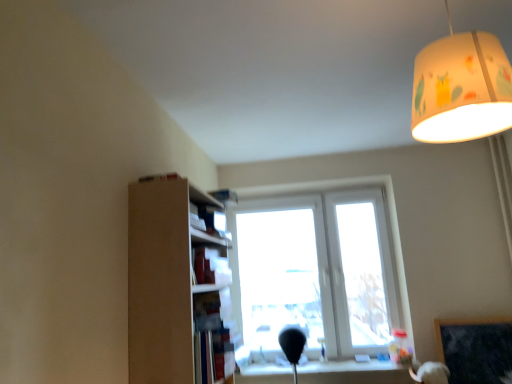
What do you see at coordinates (176, 287) in the screenshot?
I see `brown cardboard shelf at left` at bounding box center [176, 287].

Describe the element at coordinates (461, 88) in the screenshot. I see `white fabric lampshade at upper right` at that location.

In order to face hardcover book at upper center, should I rotate leftwards or rightwards?

To align with it, rotate left about 6.131°.

The height and width of the screenshot is (384, 512). What do you see at coordinates (209, 220) in the screenshot? I see `hardcover book at upper center` at bounding box center [209, 220].

At what (x,y) coordinates should I click in order to perform the action: click on brown cardboard shelf at left. Please return your answer as a coordinate pair (x, y). The height and width of the screenshot is (384, 512). Looking at the image, I should click on (176, 287).

Between dark gray matte bulletin board at lower right and hardcover book at upper center, which one appears on the left side from the viewer's perspective?

hardcover book at upper center is more to the left.

From the image's perspective, does dark gray matte bulletin board at lower right appear lower than hardcover book at upper center?

Correct, dark gray matte bulletin board at lower right appears lower than hardcover book at upper center in the image.

Is dark gray matte bulletin board at lower right touching hardcover book at upper center?

dark gray matte bulletin board at lower right and hardcover book at upper center are not in contact.

Considering the positions of objects dark gray matte bulletin board at lower right and hardcover book at upper center in the image provided, who is in front, dark gray matte bulletin board at lower right or hardcover book at upper center?

hardcover book at upper center is in front.

From a real-world perspective, which is physically above, transparent glass window at center or dark gray matte bulletin board at lower right?

From a 3D spatial view, transparent glass window at center is above.

Is transparent glass window at center next to dark gray matte bulletin board at lower right and touching it?

No, transparent glass window at center is not with dark gray matte bulletin board at lower right.

Is point (268, 235) positioned behind point (459, 320)?

Yes, it is behind point (459, 320).

Is transparent glass window at center further to the viewer compared to dark gray matte bulletin board at lower right?

That is True.

Is dark gray matte bulletin board at lower right facing away from transparent glass window at center?

No.

From a real-world perspective, is dark gray matte bulletin board at lower right on top of transparent glass window at center?

No, from a real-world perspective, dark gray matte bulletin board at lower right is not above transparent glass window at center.

From the image's perspective, is dark gray matte bulletin board at lower right positioned above or below transparent glass window at center?

dark gray matte bulletin board at lower right is below transparent glass window at center.

Is dark gray matte bulletin board at lower right bigger than transparent glass window at center?

Incorrect, dark gray matte bulletin board at lower right is not larger than transparent glass window at center.

Is point (509, 102) positioned in front of point (192, 221)?

Yes.

Is white fabric lampshade at upper right positioned far away from hardcover book at upper center?

Yes, white fabric lampshade at upper right and hardcover book at upper center are quite far apart.

Is white fabric lampshade at upper right taller than hardcover book at upper center?

Indeed, white fabric lampshade at upper right has a greater height compared to hardcover book at upper center.

Which object is further away from the camera, white fabric lampshade at upper right or hardcover book at upper center?

hardcover book at upper center.

Is dark gray matte bulletin board at lower right facing away from brown cardboard shelf at left?

dark gray matte bulletin board at lower right does not have its back to brown cardboard shelf at left.

From a real-world perspective, which is physically above, dark gray matte bulletin board at lower right or brown cardboard shelf at left?

brown cardboard shelf at left is physically above.

Considering the sizes of dark gray matte bulletin board at lower right and brown cardboard shelf at left in the image, is dark gray matte bulletin board at lower right wider or thinner than brown cardboard shelf at left?

Considering their sizes, dark gray matte bulletin board at lower right looks slimmer than brown cardboard shelf at left.

Can you confirm if dark gray matte bulletin board at lower right is positioned to the right of brown cardboard shelf at left?

Correct, you'll find dark gray matte bulletin board at lower right to the right of brown cardboard shelf at left.

Considering their positions, is transparent glass window at center located in front of or behind brown cardboard shelf at left?

Visually, transparent glass window at center is located behind brown cardboard shelf at left.

Is transparent glass window at center completely or partially outside of brown cardboard shelf at left?

Indeed, transparent glass window at center is completely outside brown cardboard shelf at left.

Is transparent glass window at center oriented away from brown cardboard shelf at left?

No, transparent glass window at center's orientation is not away from brown cardboard shelf at left.

Is point (256, 259) positioned before point (147, 366)?

No.

Which of these two, brown cardboard shelf at left or hardcover book at upper center, stands shorter?

hardcover book at upper center.

Is brown cardboard shelf at left oriented towards hardcover book at upper center?

Yes, brown cardboard shelf at left faces towards hardcover book at upper center.

Between brown cardboard shelf at left and hardcover book at upper center, which one has smaller width?

hardcover book at upper center is thinner.

Considering the relative sizes of brown cardboard shelf at left and hardcover book at upper center in the image provided, is brown cardboard shelf at left smaller than hardcover book at upper center?

No.

You are a GUI agent. You are given a task and a screenshot of the screen. Output one action in this format:
    pyautogui.click(x=<x>, y=<y>)
    Task: Click on the book on the left of dark gray matte bulletin board at lower right
    This screenshot has height=384, width=512.
    Given the screenshot: What is the action you would take?
    pyautogui.click(x=209, y=220)

Find the location of a particular element. window above the dark gray matte bulletin board at lower right (from the image's perspective) is located at coordinates (316, 265).

From the image, which object appears to be farther from dark gray matte bulletin board at lower right, white fabric lampshade at upper right or brown cardboard shelf at left?

The object further to dark gray matte bulletin board at lower right is white fabric lampshade at upper right.

In the scene shown: Which object lies nearer to the anchor point hardcover book at upper center, dark gray matte bulletin board at lower right or transparent glass window at center?

transparent glass window at center lies closer to hardcover book at upper center than the other object.

From the image, which object appears to be farther from transparent glass window at center, hardcover book at upper center or white fabric lampshade at upper right?

white fabric lampshade at upper right.

Looking at the image, which one is located further to dark gray matte bulletin board at lower right, hardcover book at upper center or brown cardboard shelf at left?

Among the two, hardcover book at upper center is located further to dark gray matte bulletin board at lower right.

Looking at this image, considering their positions, is brown cardboard shelf at left positioned further to dark gray matte bulletin board at lower right than hardcover book at upper center?

The object further to dark gray matte bulletin board at lower right is hardcover book at upper center.

Estimate the real-world distances between objects in this image. Which object is closer to dark gray matte bulletin board at lower right, transparent glass window at center or brown cardboard shelf at left?

transparent glass window at center.

Based on their spatial positions, is hardcover book at upper center or brown cardboard shelf at left further from transparent glass window at center?

Based on the image, brown cardboard shelf at left appears to be further to transparent glass window at center.

When comparing their distances from transparent glass window at center, does hardcover book at upper center or dark gray matte bulletin board at lower right seem closer?

dark gray matte bulletin board at lower right is closer to transparent glass window at center.

Identify the location of window located between brown cardboard shelf at left and dark gray matte bulletin board at lower right in the left-right direction. The height and width of the screenshot is (384, 512). (316, 265).

Locate an element on the screen. This screenshot has width=512, height=384. window situated between hardcover book at upper center and dark gray matte bulletin board at lower right from left to right is located at coordinates (316, 265).

This screenshot has width=512, height=384. Identify the location of lamp located between brown cardboard shelf at left and dark gray matte bulletin board at lower right in the left-right direction. (461, 88).

This screenshot has width=512, height=384. What are the coordinates of `shelf located between white fabric lampshade at upper right and transparent glass window at center in the depth direction` in the screenshot? It's located at (176, 287).